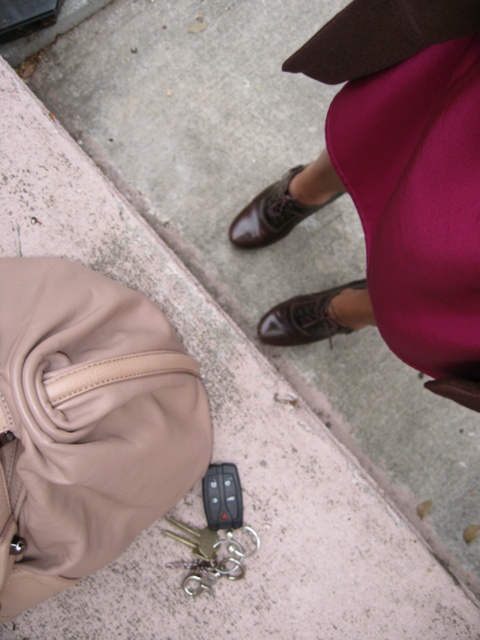
You are standing on the sidewalk and see two points marked on the ground. One is at coordinates point (204,417) and the other is at point (322,300). If you are facing forward, which point is closer to you?

Point (322,300) is closer to you because it is behind point (204,417), which is in front.